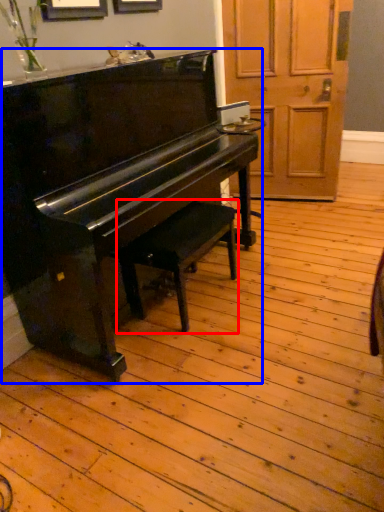
Question: Which object appears closest to the camera in this image, music stool (highlighted by a red box) or piano (highlighted by a blue box)?

Choices:
 (A) music stool
 (B) piano

Answer: (B)